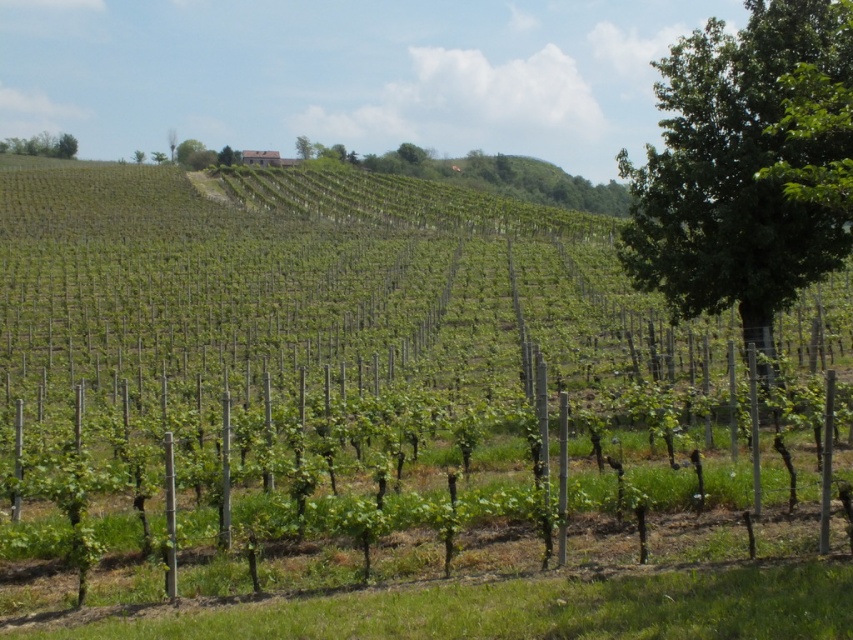
Question: Is green leafy tree at right to the left of green leafy tree at upper left from the viewer's perspective?

Choices:
 (A) no
 (B) yes

Answer: (A)

Question: Does green leafy vines at center have a smaller size compared to green leafy tree at upper center?

Choices:
 (A) no
 (B) yes

Answer: (A)

Question: Which point is farther to the camera?

Choices:
 (A) (744, 250)
 (B) (308, 140)
 (C) (44, 140)
 (D) (685, 417)

Answer: (B)

Question: Which point is farther to the camera?

Choices:
 (A) (119, 292)
 (B) (682, 54)
 (C) (39, 150)
 (D) (296, 154)

Answer: (D)

Question: Among these objects, which one is nearest to the camera?

Choices:
 (A) green leafy vines at center
 (B) green leafy tree at right
 (C) green leafy tree at upper left
 (D) green leafy tree at upper center

Answer: (A)

Question: Observing the image, what is the correct spatial positioning of green leafy vines at center in reference to green leafy tree at upper left?

Choices:
 (A) below
 (B) above

Answer: (A)